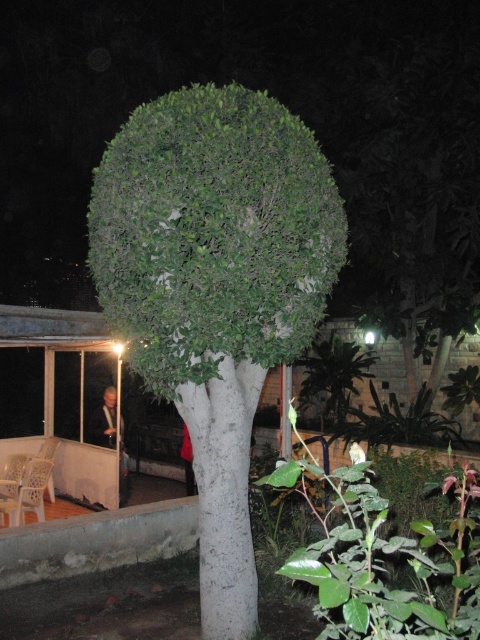
Based on the photo, you are standing in the garden and want to sit down on the white plastic chair at lower left. However, you notice the green leafy tree at center might block your view of the veranda behind you. Is the tree positioned in a way that it would block your view when sitting on the chair?

The green leafy tree at center is located above the white plastic chair at lower left, so when sitting on the chair, the tree would block your view of the veranda behind you.

You are planning to place a white plastic chair at lower left in the garden. Considering the space occupied by the green leafy tree at center, will the chair fit without being under the tree?

The green leafy tree at center might be wider than the white plastic chair at lower left, so there is a possibility that placing the chair might result in it being under the tree if the tree occupies more space. To ensure the chair is not under the tree, you should position it outside the tree canopy area.